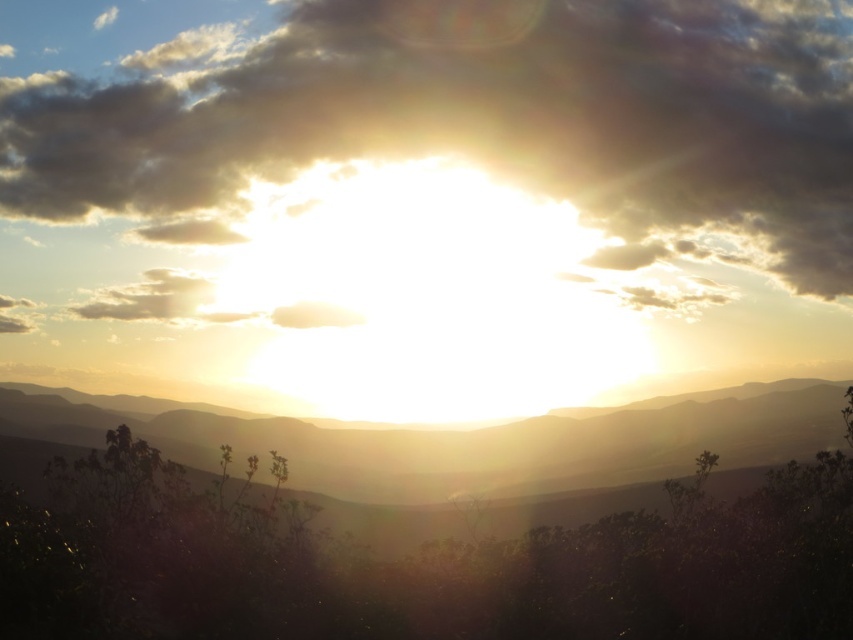
Question: Is cloudy sky at upper center below silhouetted rock formation at center?

Choices:
 (A) yes
 (B) no

Answer: (B)

Question: Which point appears farthest from the camera in this image?

Choices:
 (A) (737, 189)
 (B) (677, 461)

Answer: (A)

Question: Is cloudy sky at upper center wider than silhouetted rock formation at center?

Choices:
 (A) no
 (B) yes

Answer: (B)

Question: Which point appears farthest from the camera in this image?

Choices:
 (A) (668, 426)
 (B) (343, 88)

Answer: (B)

Question: Which of the following is the closest to the observer?

Choices:
 (A) pyautogui.click(x=785, y=144)
 (B) pyautogui.click(x=509, y=440)

Answer: (B)

Question: Does cloudy sky at upper center appear over silhouetted rock formation at center?

Choices:
 (A) no
 (B) yes

Answer: (B)